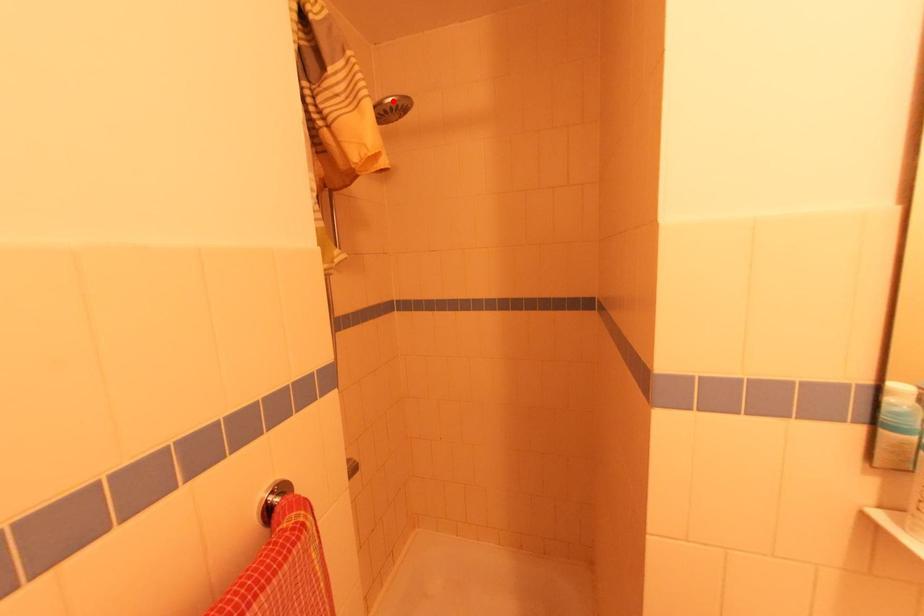
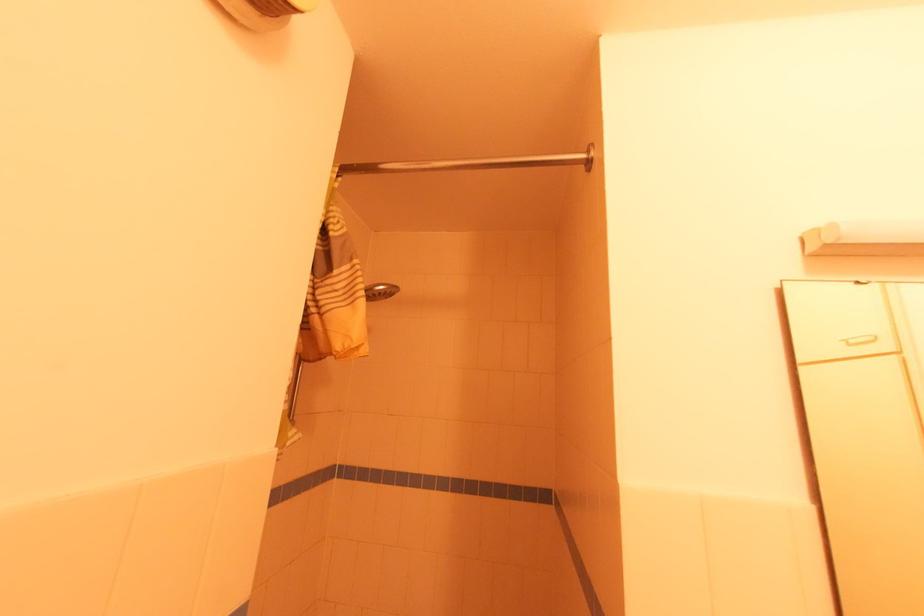
Question: I am providing you with two images of the same scene from different viewpoints. A red point is marked on the first image. Can you still see the location of the red point in image 2?

Choices:
 (A) Yes
 (B) No

Answer: (A)